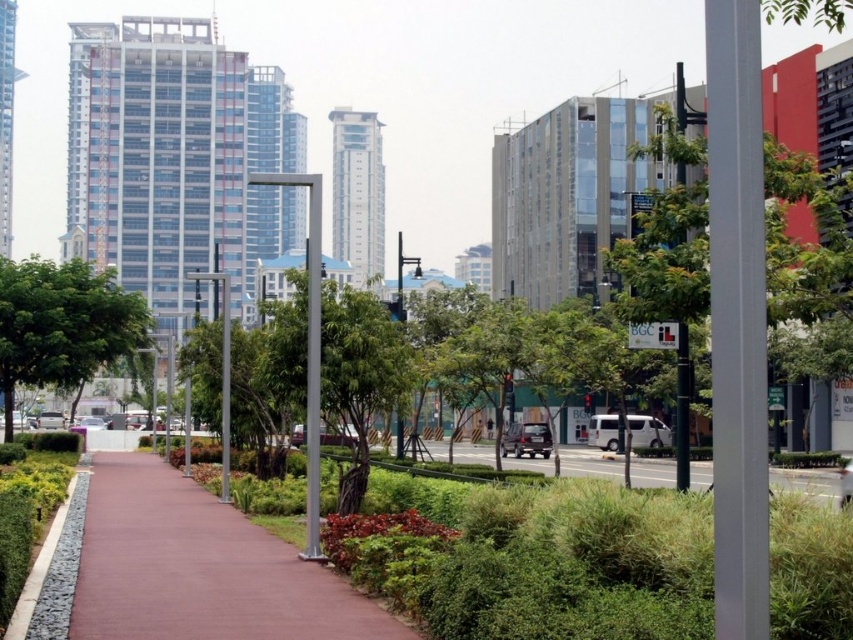
Consider the image. You are standing at the camera position and want to walk to the brown rubber pavement at center. Approximately how many steps would you need to take if each step covers about 3 feet?

The distance between you and the brown rubber pavement at center is 29.68 feet. Since each step covers about 3 feet, dividing 29.68 by 3 gives approximately 9.89 steps. Therefore, you would need to take around 10 steps to reach the brown rubber pavement at center.

You are a gardener who needs to mow the lawn. You see the brown rubber pavement at center and the green grass at center. Which one is lower to the ground and easier to mow around?

The brown rubber pavement at center is lower than the green grass at center, so it is easier to mow around the green grass at center.

You are a gardener planning to plant a new row of bushes between the green leafy tree at left and the green grass at center. Considering their current widths, which area would require more space for the bushes?

The green grass at center has a greater width than the green leafy tree at left, so planting bushes between them would require more space at the area near the green grass at center.